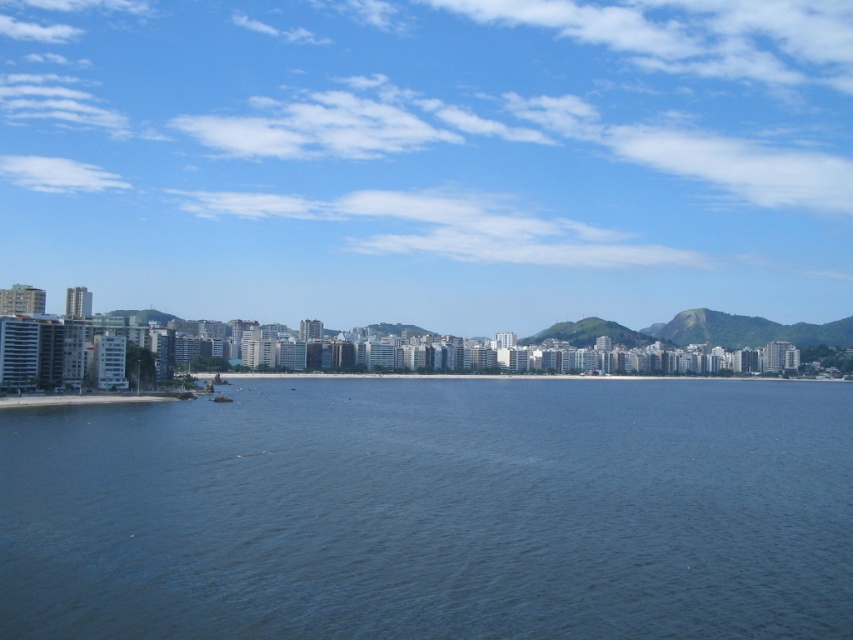
You are standing at the beach looking towards the city buildings. There are two points marked in the image, one at coordinates point (357, 410) and another at point (108, 396). Which point is closer to you?

Point (108, 396) is closer to you because it is nearer to the camera compared to point (357, 410).

You are a photographer trying to capture the entire coastal cityscape. You notice the blue sky at upper center and the blue liquid water at center. Which of these two elements occupies a larger horizontal space in the image?

The blue sky at upper center might be wider than blue liquid water at center, so it likely occupies a larger horizontal space in the image.

You are standing on the gray concrete shoreline at lower left and want to look up to the blue sky at upper center. Which direction should you move your gaze?

To look from the gray concrete shoreline at lower left to the blue sky at upper center, you should move your gaze upward since the blue sky at upper center is further away from you compared to the gray concrete shoreline at lower left.